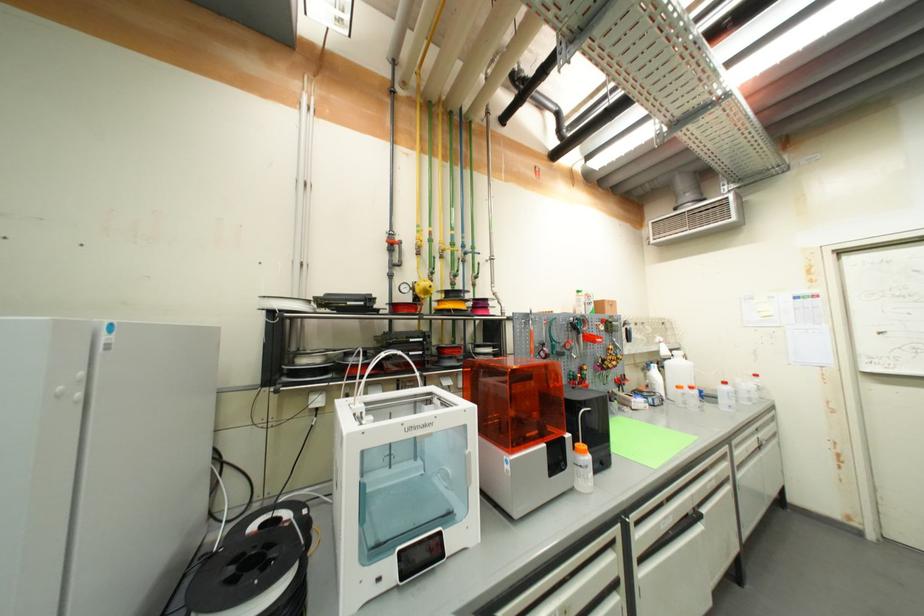
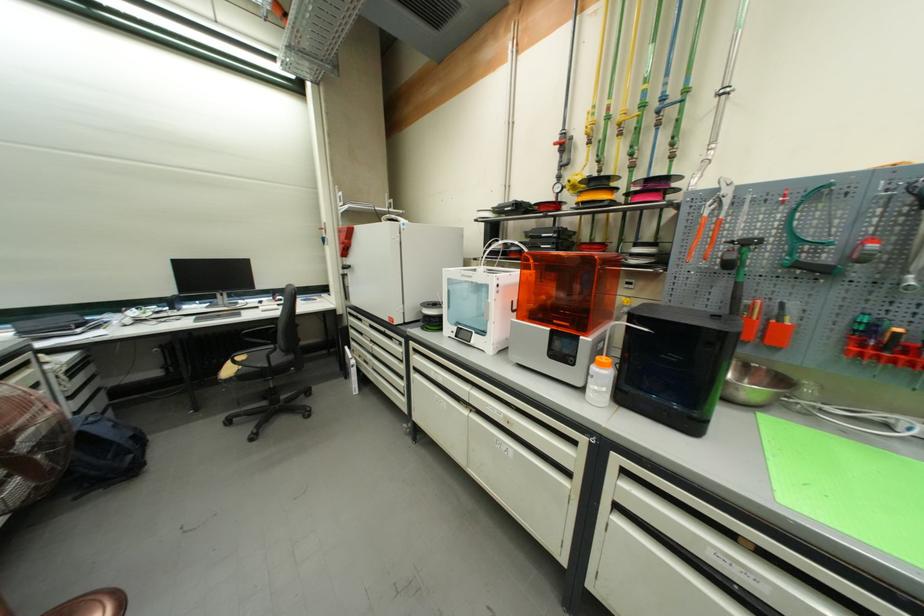
In the second image, find the point that corresponds to [589,454] in the first image.

(606, 367)